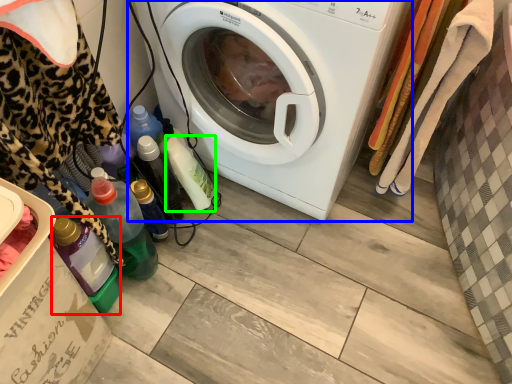
Question: Which object is positioned closest to bottle (highlighted by a red box)? Select from washing machine (highlighted by a blue box) and bottle (highlighted by a green box).

Choices:
 (A) washing machine
 (B) bottle

Answer: (B)